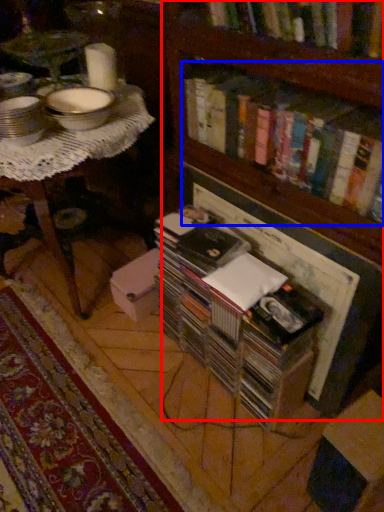
Question: Which object is closer to the camera taking this photo, bookcase (highlighted by a red box) or book (highlighted by a blue box)?

Choices:
 (A) bookcase
 (B) book

Answer: (A)